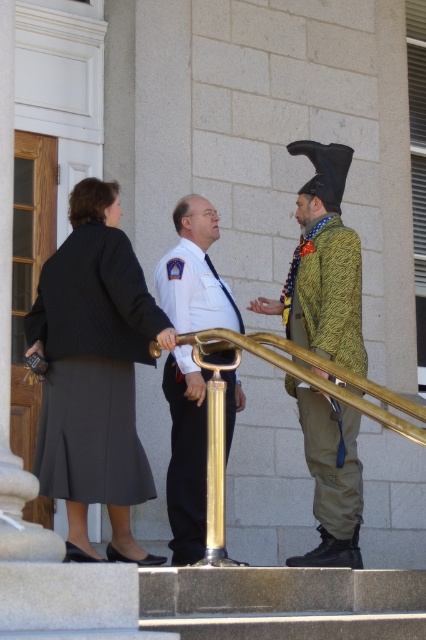
You are a security guard at the building entrance. You need to check the items carried by the dark gray wool skirt at center and the green textured jacket at right. According to the scene description, which one is closer to the entrance?

The dark gray wool skirt at center is closer to the entrance because it is to the left of the green textured jacket at right, and the entrance is on the left side of the building as per the scene description.

You are a security guard at the building. You need to check the size of the dark gray wool skirt at center and the green textured jacket at right. Which one is larger?

The dark gray wool skirt at center is bigger than the green textured jacket at right.

From the picture: You are a security guard at the building entrance. You need to verify the size of the uniforms to ensure compliance with the dress code. The dress code requires that the uniform must be of standard size, not smaller than the other staff members. Which uniform between the white uniform at center and the green textured jacket at right meets the dress code requirement?

The white uniform at center meets the dress code requirement because it has a larger size compared to the green textured jacket at right, ensuring it is not smaller than other staff members.